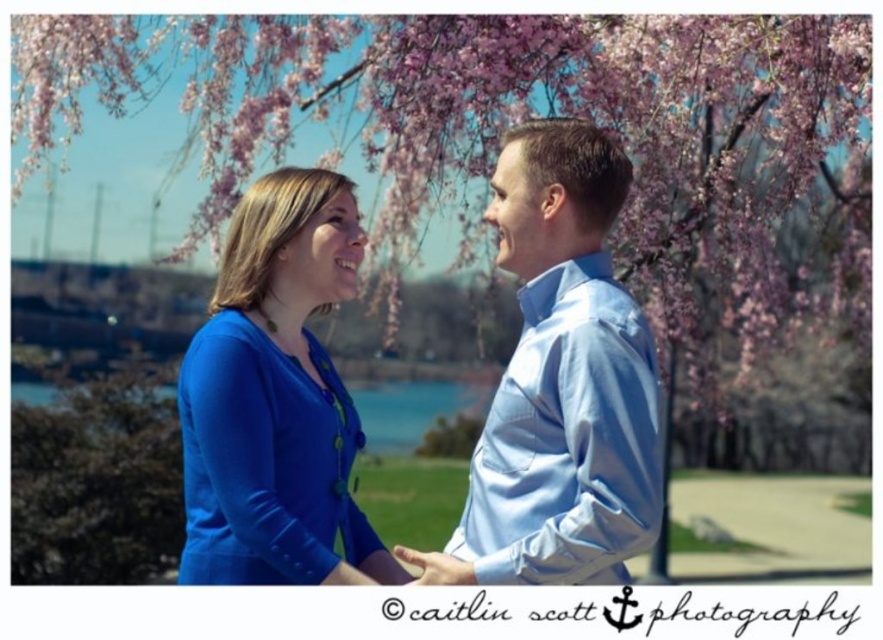
Question: Which point is closer to the camera taking this photo?

Choices:
 (A) (208, 128)
 (B) (319, 536)
 (C) (634, 342)
 (D) (461, 560)

Answer: (C)

Question: Which point is closer to the camera taking this photo?

Choices:
 (A) (431, 557)
 (B) (557, 538)
 (C) (811, 218)

Answer: (B)

Question: Can you confirm if pink silky flower at upper center is positioned to the left of green leafy tree at left?

Choices:
 (A) no
 (B) yes

Answer: (A)

Question: Does light blue satin shirt at center appear on the left side of green leafy tree at left?

Choices:
 (A) yes
 (B) no

Answer: (B)

Question: Which point is closer to the camera?

Choices:
 (A) light blue satin shirt at center
 (B) green leafy tree at left
 (C) pink silky flower at upper center

Answer: (A)

Question: Does light blue satin shirt at center have a greater width compared to matte blue blouse at center?

Choices:
 (A) yes
 (B) no

Answer: (B)